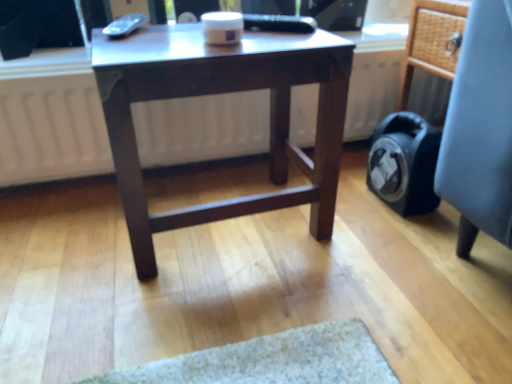
The height and width of the screenshot is (384, 512). I want to click on unoccupied area in front of dark brown wood table at center, so click(x=226, y=316).